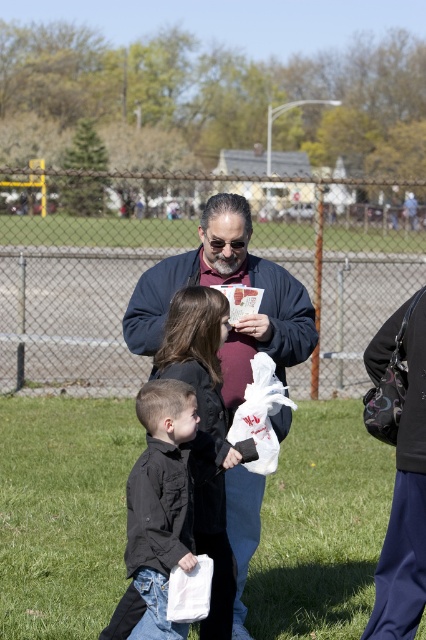
Question: Among these points, which one is farthest from the camera?

Choices:
 (A) (308, 316)
 (B) (129, 474)

Answer: (A)

Question: Is dark blue jacket at center bigger than black matte shirt at center?

Choices:
 (A) yes
 (B) no

Answer: (A)

Question: Which of the following is the farthest from the observer?

Choices:
 (A) black matte shirt at center
 (B) dark blue jacket at center

Answer: (B)

Question: Is dark blue jacket at center further to camera compared to black matte shirt at center?

Choices:
 (A) no
 (B) yes

Answer: (B)

Question: From the image, what is the correct spatial relationship of dark blue jacket at center in relation to black matte shirt at center?

Choices:
 (A) left
 (B) right

Answer: (B)